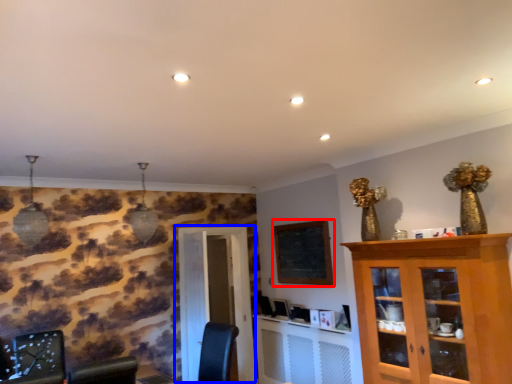
Question: Which point is further to the camera, bulletin board (highlighted by a red box) or door (highlighted by a blue box)?

Choices:
 (A) bulletin board
 (B) door

Answer: (B)